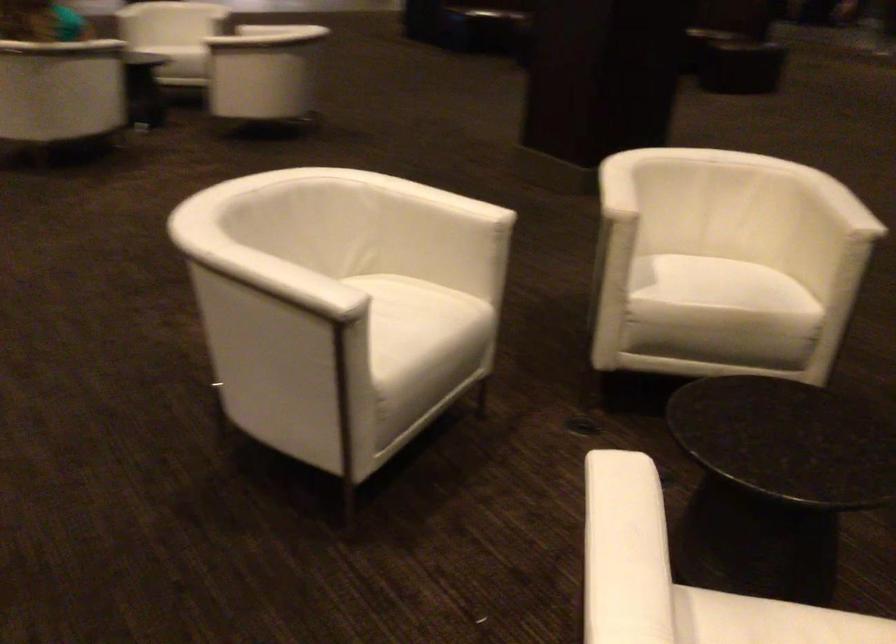
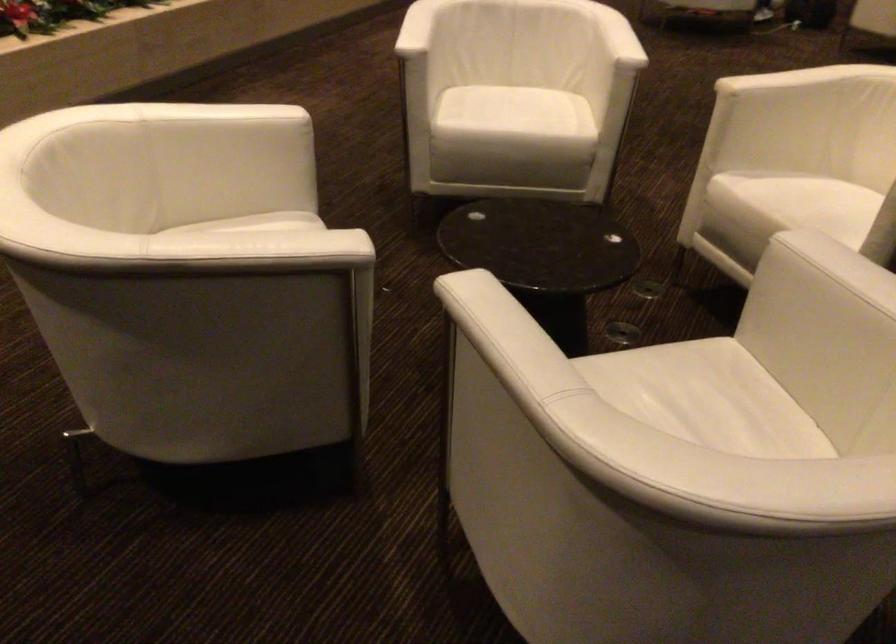
Locate, in the second image, the point that corresponds to point 460,199 in the first image.

(617, 37)